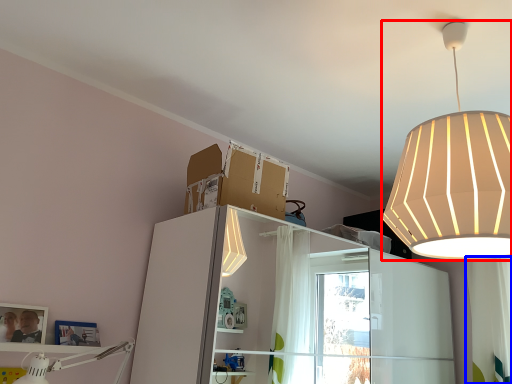
Question: Which object appears closest to the camera in this image, lamp (highlighted by a red box) or curtain (highlighted by a blue box)?

Choices:
 (A) lamp
 (B) curtain

Answer: (A)